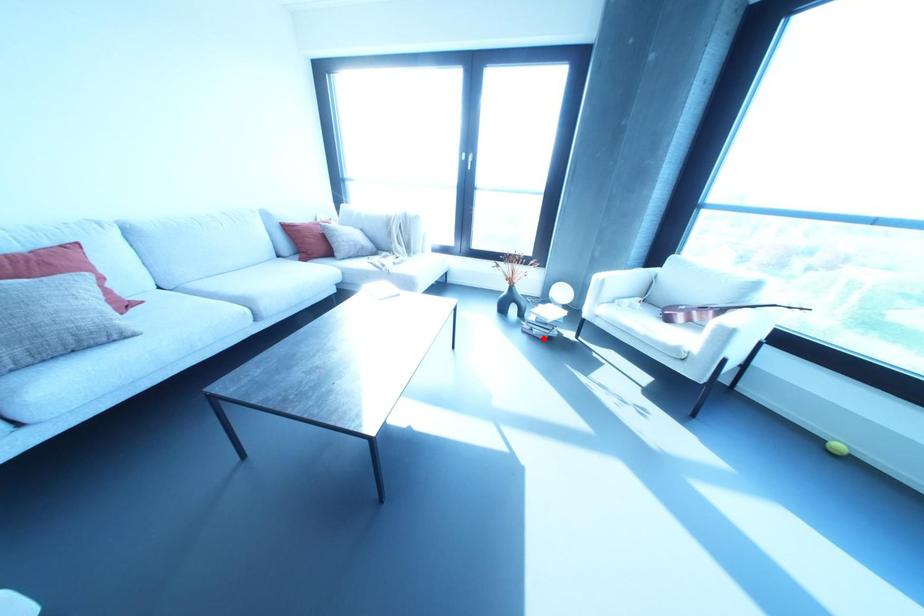
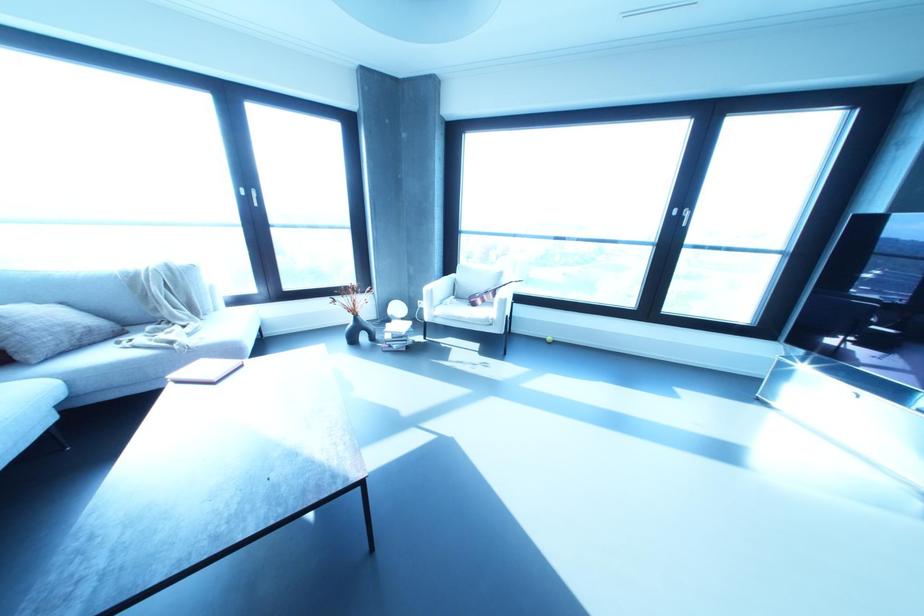
The point at the highlighted location is marked in the first image. Where is the corresponding point in the second image?

(404, 349)